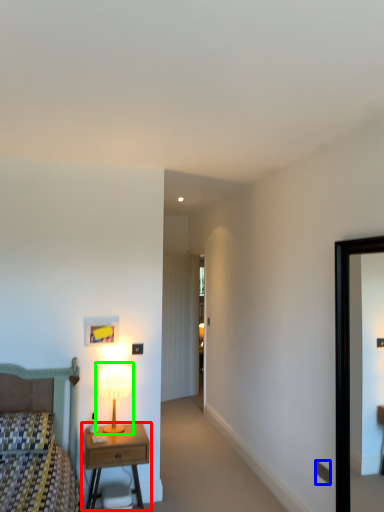
Question: Estimate the real-world distances between objects in this image. Which object is closer to nightstand (highlighted by a red box), electric outlet (highlighted by a blue box) or table lamp (highlighted by a green box)?

Choices:
 (A) electric outlet
 (B) table lamp

Answer: (B)